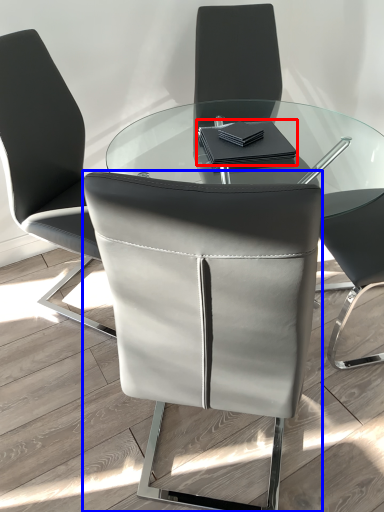
Question: Among these objects, which one is nearest to the camera, notebook (highlighted by a red box) or chair (highlighted by a blue box)?

Choices:
 (A) notebook
 (B) chair

Answer: (B)